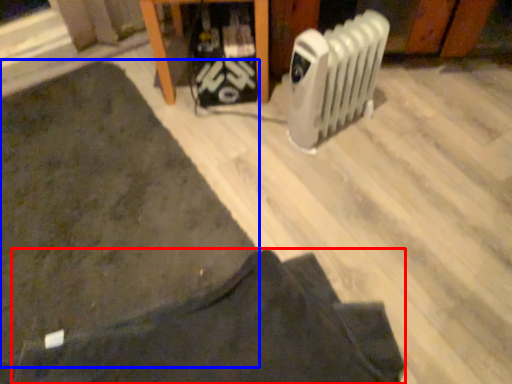
Question: Which object is further to the camera taking this photo, clothing (highlighted by a red box) or mat (highlighted by a blue box)?

Choices:
 (A) clothing
 (B) mat

Answer: (B)